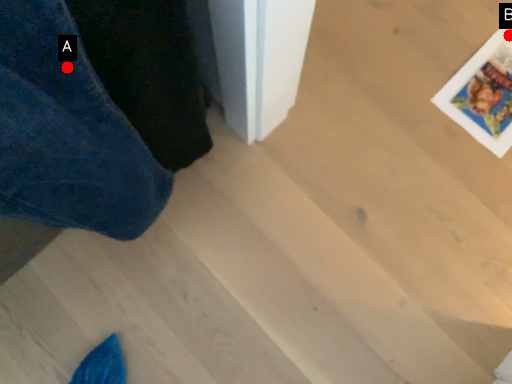
Question: Two points are circled on the image, labeled by A and B beside each circle. Among these points, which one is farthest from the camera?

Choices:
 (A) A is further
 (B) B is further

Answer: (B)